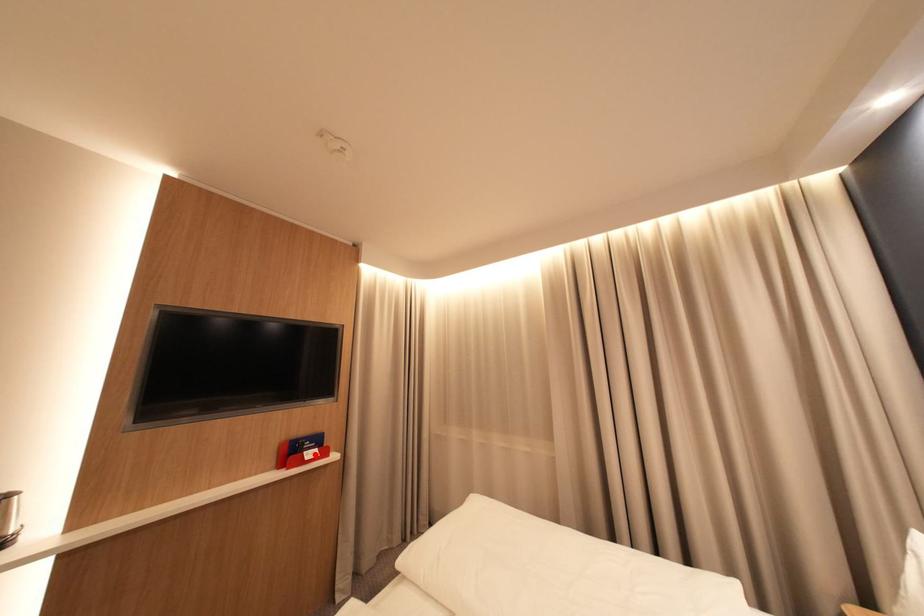
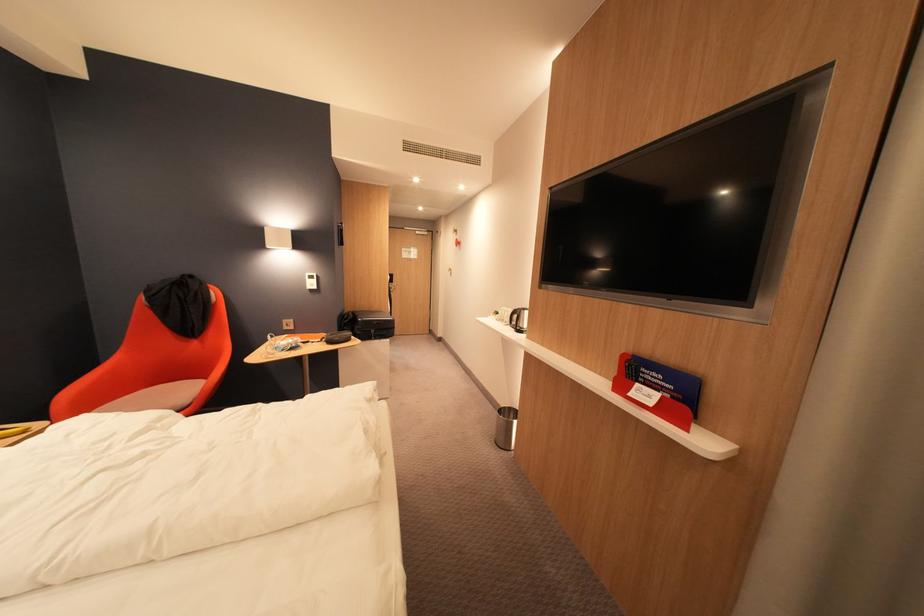
Where in the second image is the point corresponding to the highlighted location from the first image?

(648, 386)